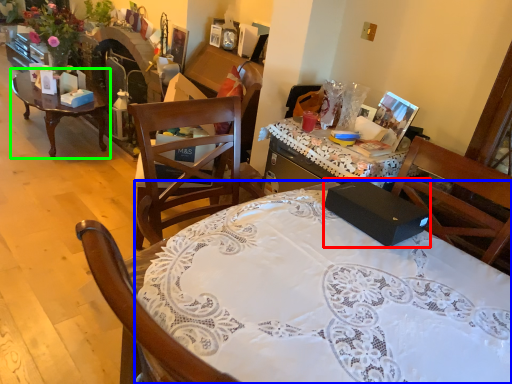
Question: Estimate the real-world distances between objects in this image. Which object is farther from box (highlighted by a red box), desk (highlighted by a blue box) or coffee table (highlighted by a green box)?

Choices:
 (A) desk
 (B) coffee table

Answer: (B)